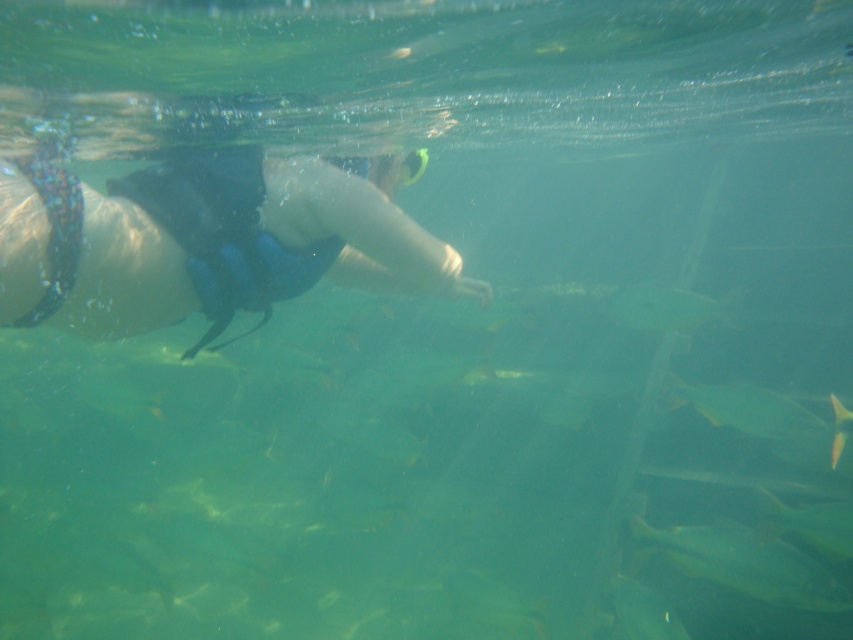
Can you confirm if green translucent fish at lower right is bigger than green matte fish at center?

Indeed, green translucent fish at lower right has a larger size compared to green matte fish at center.

Does point (706, 560) come in front of point (637, 289)?

Yes, point (706, 560) is in front of point (637, 289).

Who is more forward, (781, 573) or (628, 317)?

Point (781, 573)

Find the location of a particular element. green translucent fish at lower right is located at coordinates point(746,563).

Does green translucent fish at lower right appear under translucent greenish-yellow fish at lower center?

No.

The width and height of the screenshot is (853, 640). Describe the element at coordinates (746, 563) in the screenshot. I see `green translucent fish at lower right` at that location.

Is point (741, 557) farther from viewer compared to point (614, 611)?

No, it is in front of (614, 611).

I want to click on green translucent fish at lower right, so click(x=746, y=563).

Can you confirm if green matte fish at center is positioned to the right of green matte fish at lower right?

Yes, green matte fish at center is to the right of green matte fish at lower right.

Who is higher up, green matte fish at center or green matte fish at lower right?

green matte fish at center is above.

Find the location of a particular element. green matte fish at center is located at coordinates (666, 307).